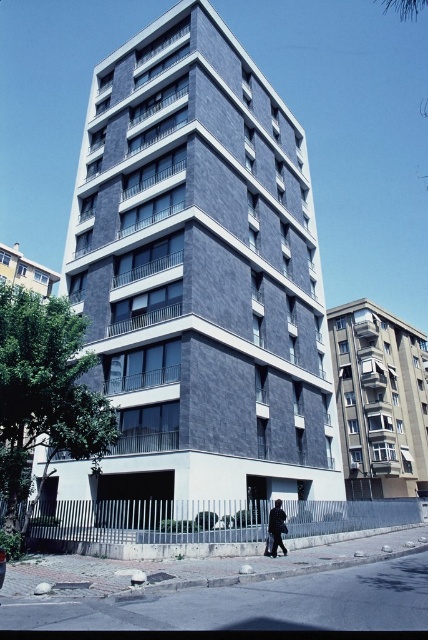
You are a city planner reviewing a new housing development proposal. The proposal includes two buildings, the dark gray stone building at center and the dark gray stone building at right. According to the architectural plans, which building would require a narrower foundation to support its structure?

The dark gray stone building at center has a lesser width compared to the dark gray stone building at right, so it would require a narrower foundation to support its structure.

You are standing in front of the residential building and want to take a photo. There are two points marked on the building facade at coordinates point (44, 492) and point (21, 259). Which point will appear larger in your camera view?

Point (44, 492) is closer to the camera than point (21, 259), so it will appear larger in the camera view.